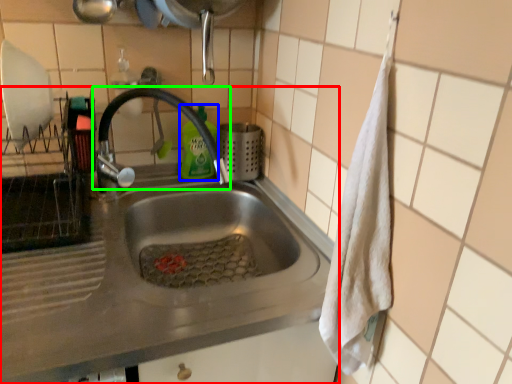
Question: Which is nearer to the sink (highlighted by a red box)? cleaning product (highlighted by a blue box) or tap (highlighted by a green box).

Choices:
 (A) cleaning product
 (B) tap

Answer: (B)